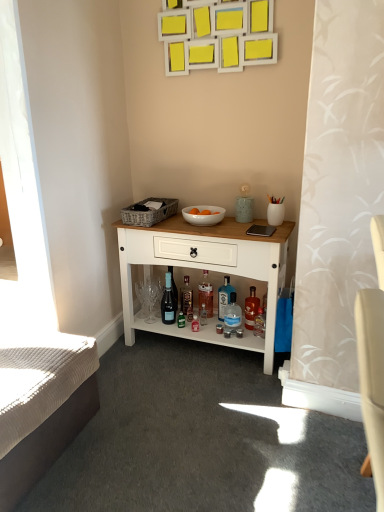
Question: In the image, is blue glass bottle at lower center, which ranks as the 3th bottle in right-to-left order, on the left side or the right side of translucent glass bottle at lower center, placed as the fifth bottle when sorted from left to right?

Choices:
 (A) left
 (B) right

Answer: (A)

Question: From the image's perspective, is blue glass bottle at lower center, which ranks as the 3th bottle in right-to-left order, above or below translucent glass bottle at lower center, which appears as the first bottle when viewed from the right?

Choices:
 (A) below
 (B) above

Answer: (B)

Question: Based on their relative distances, which object is farther from the translucent glass bottle at center, the fourth bottle viewed from the right?

Choices:
 (A) transparent glass bottle at center, the 4th bottle when ordered from left to right
 (B) blue glass bottle at lower center, the 3th bottle positioned from the left
 (C) translucent glass bottle at lower center, which appears as the first bottle when viewed from the right
 (D) white wood cabinet at center
 (E) translucent glass bottle at center, which is the fifth bottle from right to left

Answer: (D)

Question: Considering the real-world distances, which object is farthest from the translucent glass bottle at lower center, placed as the fifth bottle when sorted from left to right?

Choices:
 (A) white glossy bowl at center
 (B) white wood cabinet at center
 (C) matte glass wine bottle at center
 (D) white textured mattress at lower left
 (E) blue glass bottle at lower center, which ranks as the 3th bottle in right-to-left order

Answer: (D)